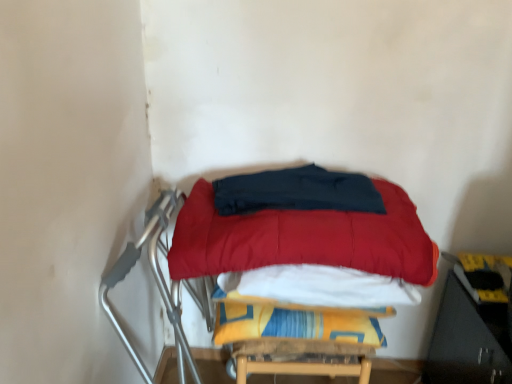
Question: Is dark blue fabric at center, the first blanket when ordered from top to bottom, in front of or behind yellow fabric blanket at center, the 2th blanket when ordered from top to bottom, in the image?

Choices:
 (A) front
 (B) behind

Answer: (A)

Question: Does point (376, 208) appear closer or farther from the camera than point (287, 319)?

Choices:
 (A) closer
 (B) farther

Answer: (A)

Question: Which object is positioned farthest from the yellow fabric blanket at center, the 2th blanket when ordered from top to bottom?

Choices:
 (A) velvet red mattress at center
 (B) dark blue fabric at center, the first blanket when ordered from top to bottom

Answer: (B)

Question: Based on their relative distances, which object is farther from the velvet red mattress at center?

Choices:
 (A) yellow fabric blanket at center, marked as the first blanket in a bottom-to-top arrangement
 (B) dark blue fabric at center, the first blanket when ordered from top to bottom

Answer: (A)